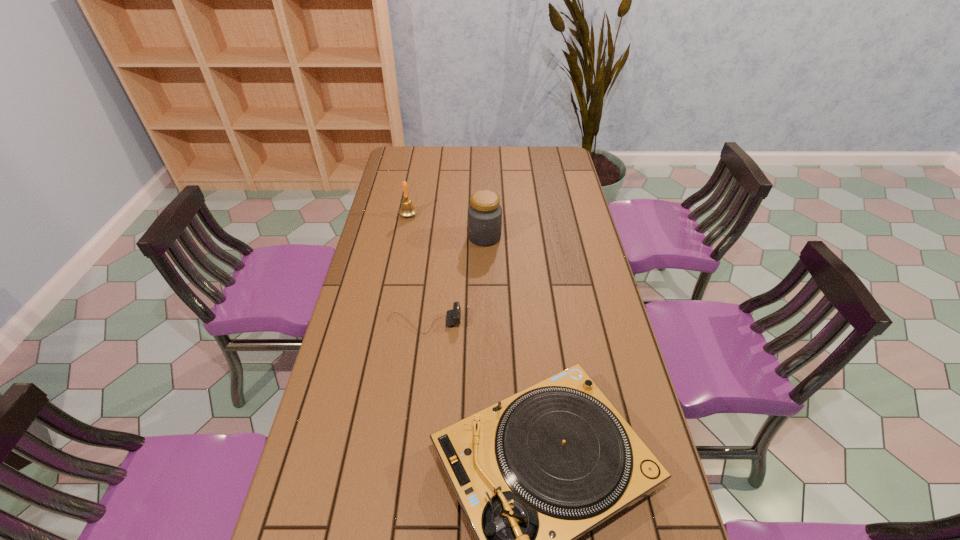
Locate an element on the screen. The width and height of the screenshot is (960, 540). jar is located at coordinates (484, 212).

Locate an element on the screen. The width and height of the screenshot is (960, 540). bell is located at coordinates (407, 209).

This screenshot has height=540, width=960. I want to click on the third farthest object, so click(453, 316).

The width and height of the screenshot is (960, 540). Identify the location of the shortest object. (453, 316).

This screenshot has width=960, height=540. I want to click on free location located 0.220m on the surface of the jar near the warning symbol, so click(x=410, y=237).

Identify the location of vacant position located 0.130m on the surface of the jar near the warning symbol. This screenshot has width=960, height=540. (434, 237).

Identify the location of free space located on the surface of the jar near the warning symbol. (442, 237).

Find the location of a particular element. The height and width of the screenshot is (540, 960). free space located 0.290m on the back of the bell is located at coordinates (417, 173).

Find the location of a particular element. The width and height of the screenshot is (960, 540). free space located on the front-facing side of the shortest object is located at coordinates (541, 323).

Image resolution: width=960 pixels, height=540 pixels. What are the coordinates of `bell that is positioned at the left edge` in the screenshot? It's located at (407, 209).